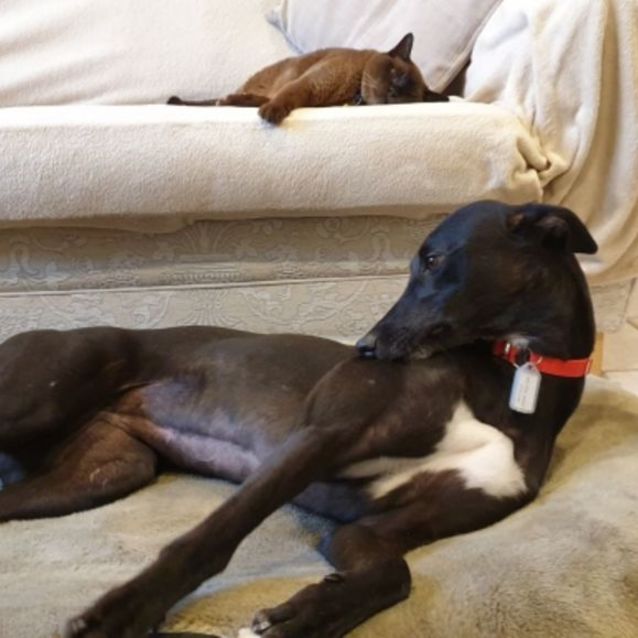
What are the coordinates of `gray plush dog bed` in the screenshot? It's located at pos(601,513).